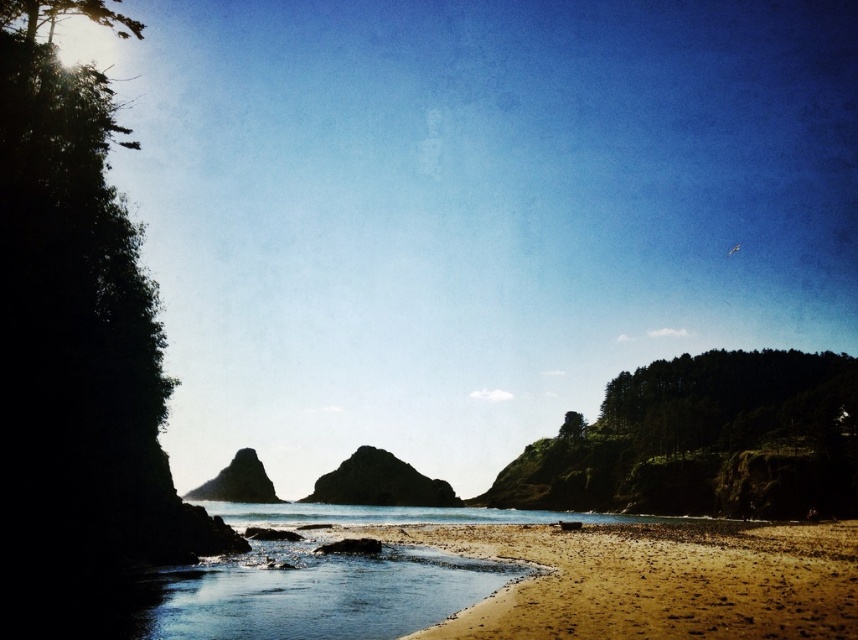
Question: Which object is positioned farthest from the smooth gray rock at center?

Choices:
 (A) brown sandy beach at lower center
 (B) dark gray rocky island at center
 (C) clear water at lower center

Answer: (C)

Question: Is clear water at lower center above dark gray rocky island at center?

Choices:
 (A) yes
 (B) no

Answer: (A)

Question: Can you confirm if brown sandy beach at lower center is positioned below smooth gray rock at center?

Choices:
 (A) yes
 (B) no

Answer: (B)

Question: Can you confirm if clear water at lower center is positioned below dark gray rocky island at center?

Choices:
 (A) no
 (B) yes

Answer: (A)

Question: Which object is positioned farthest from the smooth gray rock at center?

Choices:
 (A) dark gray rocky island at center
 (B) clear water at lower center

Answer: (B)

Question: Which is farther from the clear water at lower center?

Choices:
 (A) dark gray rocky island at center
 (B) smooth gray rock at center
 (C) brown sandy beach at lower center

Answer: (B)